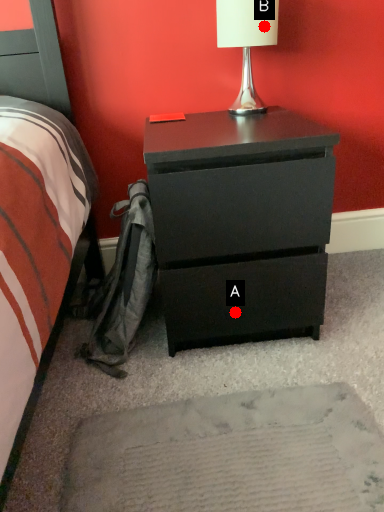
Question: Two points are circled on the image, labeled by A and B beside each circle. Which point appears closest to the camera in this image?

Choices:
 (A) A is closer
 (B) B is closer

Answer: (A)